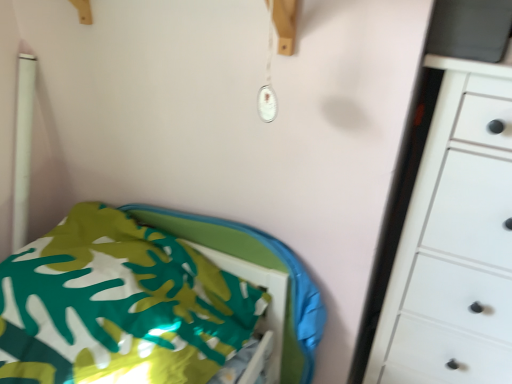
Question: From the image's perspective, is green fabric bed at lower left on top of white matte chest of drawers at right?

Choices:
 (A) no
 (B) yes

Answer: (A)

Question: Is green fabric bed at lower left turned away from white matte chest of drawers at right?

Choices:
 (A) yes
 (B) no

Answer: (B)

Question: Can you confirm if green fabric bed at lower left is thinner than white matte chest of drawers at right?

Choices:
 (A) yes
 (B) no

Answer: (B)

Question: Is green fabric bed at lower left oriented towards white matte chest of drawers at right?

Choices:
 (A) no
 (B) yes

Answer: (A)

Question: Is green fabric bed at lower left not within white matte chest of drawers at right?

Choices:
 (A) yes
 (B) no

Answer: (A)

Question: Considering the relative sizes of green fabric bed at lower left and white matte chest of drawers at right in the image provided, is green fabric bed at lower left bigger than white matte chest of drawers at right?

Choices:
 (A) yes
 (B) no

Answer: (B)

Question: Is white matte chest of drawers at right smaller than green fabric bed at lower left?

Choices:
 (A) yes
 (B) no

Answer: (B)

Question: From the image's perspective, is white matte chest of drawers at right under green fabric bed at lower left?

Choices:
 (A) no
 (B) yes

Answer: (A)

Question: Is white matte chest of drawers at right touching green fabric bed at lower left?

Choices:
 (A) no
 (B) yes

Answer: (A)

Question: From the image's perspective, is white matte chest of drawers at right above green fabric bed at lower left?

Choices:
 (A) no
 (B) yes

Answer: (B)

Question: Would you say white matte chest of drawers at right is outside green fabric bed at lower left?

Choices:
 (A) no
 (B) yes

Answer: (B)

Question: From a real-world perspective, does white matte chest of drawers at right stand above green fabric bed at lower left?

Choices:
 (A) no
 (B) yes

Answer: (B)

Question: Considering the relative positions of white matte chest of drawers at right and green fabric bed at lower left in the image provided, is white matte chest of drawers at right to the left or to the right of green fabric bed at lower left?

Choices:
 (A) left
 (B) right

Answer: (B)